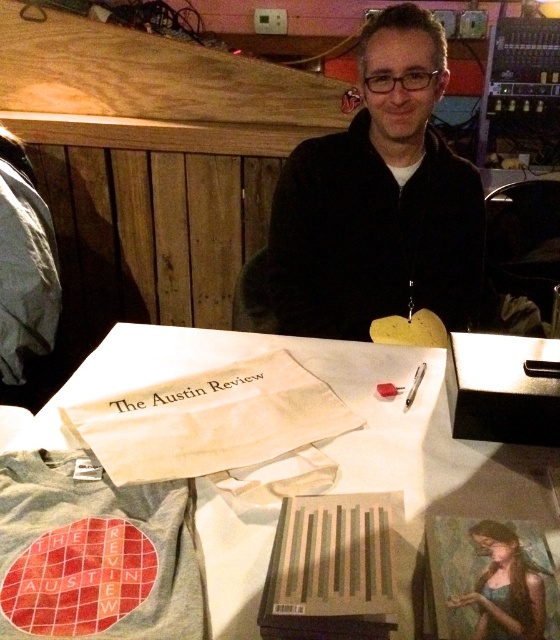
Which is more to the right, black matte jacket at center or white cloth bag at center?

From the viewer's perspective, black matte jacket at center appears more on the right side.

In the scene shown: Between black matte jacket at center and white cloth bag at center, which one has more height?

With more height is black matte jacket at center.

Does point (296, 285) come behind point (235, 392)?

Yes, it is behind point (235, 392).

The image size is (560, 640). Find the location of `black matte jacket at center`. black matte jacket at center is located at coordinates coord(380,200).

Does point (319, 161) lie in front of point (254, 620)?

No, it is not.

Can you confirm if black matte jacket at center is wider than white fabric bag at center?

Incorrect, black matte jacket at center's width does not surpass white fabric bag at center's.

Who is more forward, (424, 285) or (374, 426)?

Positioned in front is point (374, 426).

The height and width of the screenshot is (640, 560). I want to click on black matte jacket at center, so click(380, 200).

Measure the distance from black matte jacket at center to oil painting of woman at center.

The distance of black matte jacket at center from oil painting of woman at center is 37.92 inches.

Does black matte jacket at center have a greater width compared to oil painting of woman at center?

Yes.

This screenshot has height=640, width=560. What do you see at coordinates (380, 200) in the screenshot? I see `black matte jacket at center` at bounding box center [380, 200].

Image resolution: width=560 pixels, height=640 pixels. In order to click on black matte jacket at center in this screenshot , I will do `click(380, 200)`.